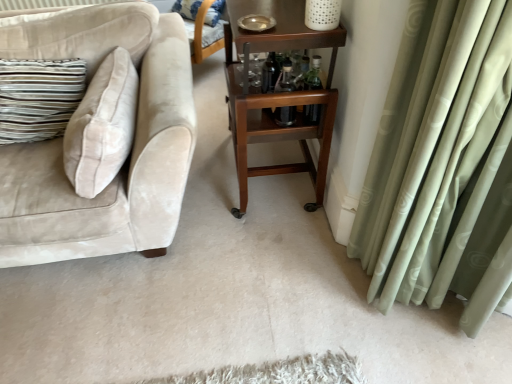
Question: From a real-world perspective, is wooden rolling cart at center positioned above or below transparent glass bottle at center, acting as the first bottle starting from the left?

Choices:
 (A) below
 (B) above

Answer: (A)

Question: Is wooden rolling cart at center inside or outside of transparent glass bottle at center, the 2th bottle positioned from the right?

Choices:
 (A) outside
 (B) inside

Answer: (A)

Question: Based on their relative distances, which object is nearer to the transparent glass bottle at center, acting as the first bottle starting from the left?

Choices:
 (A) striped fabric pillow at upper center
 (B) clear glass bottles at center, arranged as the second bottle when viewed from the left
 (C) beige velvet couch at left
 (D) wooden rolling cart at center

Answer: (B)

Question: Which is farther from the beige velvet couch at left?

Choices:
 (A) transparent glass bottle at center, the 2th bottle positioned from the right
 (B) striped fabric pillow at upper center
 (C) clear glass bottles at center, arranged as the second bottle when viewed from the left
 (D) wooden rolling cart at center

Answer: (B)